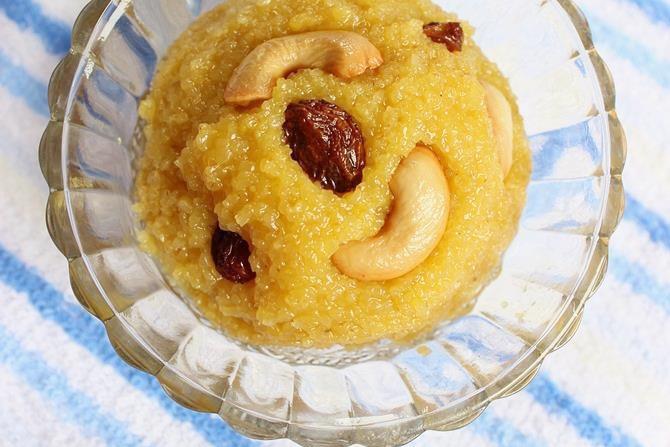
Find the location of a particular element. empty table to the upper left of bowl is located at coordinates (45, 34).